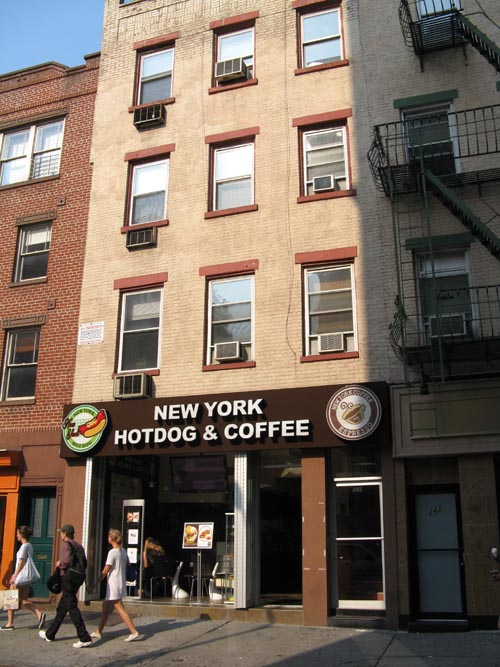
Identify the location of air conditioning unit. (142, 386), (227, 352), (331, 347), (436, 329), (325, 181), (142, 235), (155, 115), (231, 71).